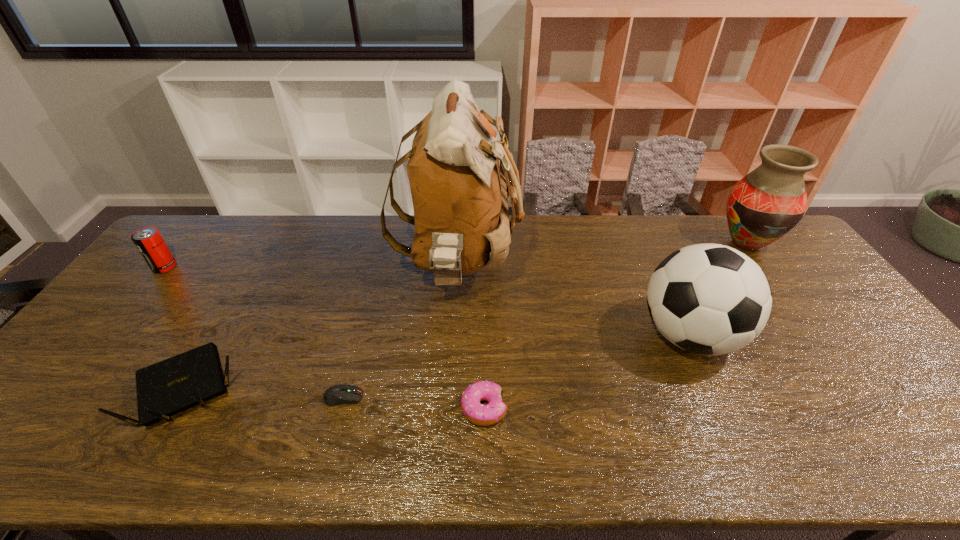
Where is `the fifth closest object relative to the computer equipment`? This screenshot has height=540, width=960. the fifth closest object relative to the computer equipment is located at coordinates (149, 242).

This screenshot has height=540, width=960. Find the location of `vacant space that satisfies the following two spatial constraints: 1. on the front-facing side of the backpack; 2. on the left side of the sixth tallest object`. vacant space that satisfies the following two spatial constraints: 1. on the front-facing side of the backpack; 2. on the left side of the sixth tallest object is located at coordinates (450, 408).

You are a GUI agent. You are given a task and a screenshot of the screen. Output one action in this format:
    pyautogui.click(x=<x>, y=<y>)
    Task: Click on the vacant space that satisfies the following two spatial constraints: 1. on the front-facing side of the backpack; 2. on the front side of the fourth tallest object
    
    Given the screenshot: What is the action you would take?
    pyautogui.click(x=458, y=267)